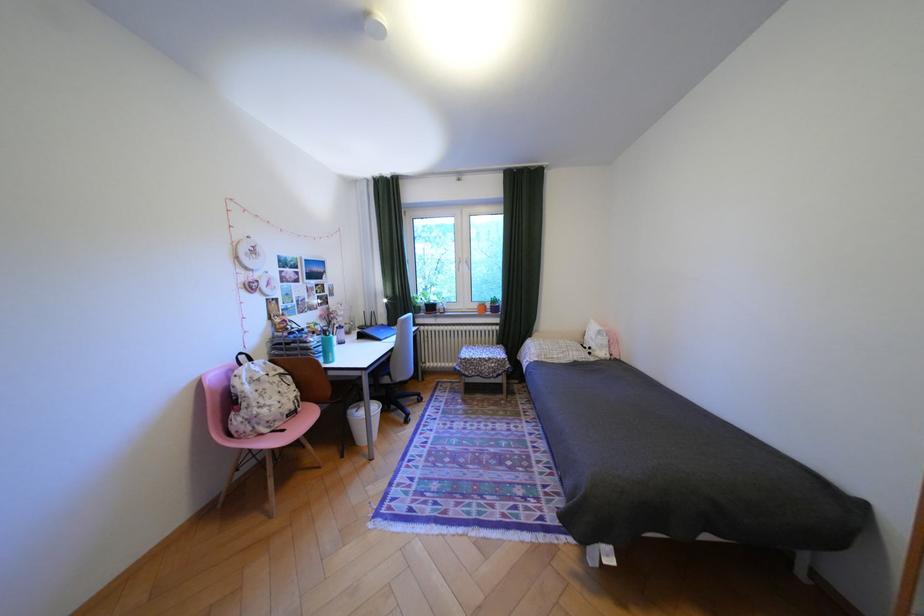
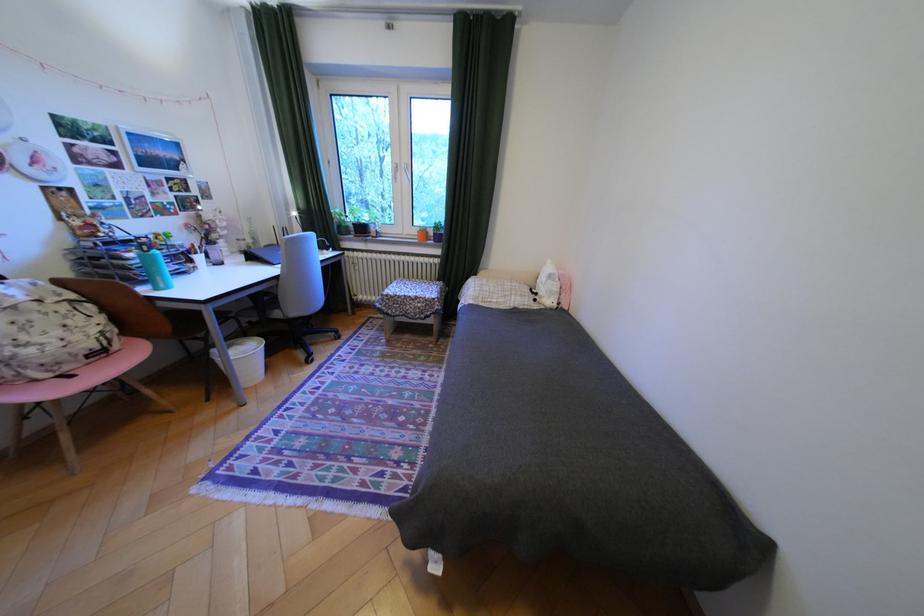
Locate, in the second image, the point that corresponds to the point at 432,307 in the first image.

(359, 227)